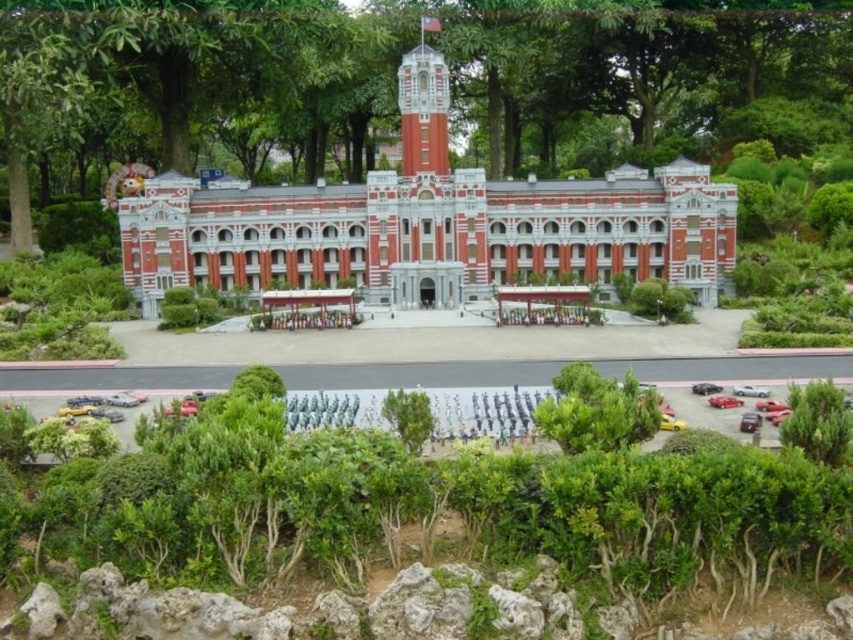
Is red brick building at center in front of red brick clock tower at upper center?

No, red brick building at center is behind red brick clock tower at upper center.

Is red brick building at center below red brick clock tower at upper center?

Indeed, red brick building at center is positioned under red brick clock tower at upper center.

Measure the distance between point (735, 195) and camera.

Point (735, 195) is 135.95 meters away from camera.

The width and height of the screenshot is (853, 640). Find the location of `red brick building at center`. red brick building at center is located at coordinates (430, 234).